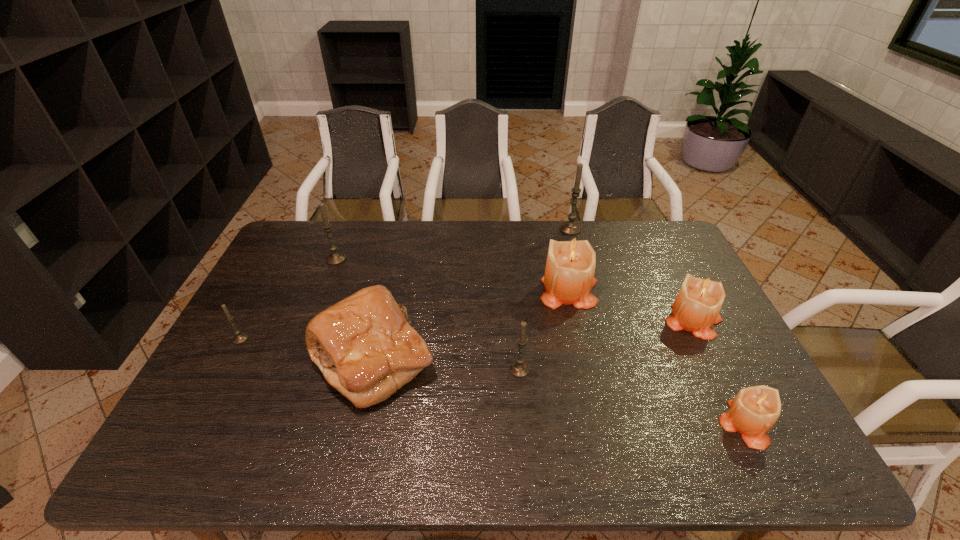
Find the location of a particular element. free space that satisfies the following two spatial constraints: 1. on the filling side of the brownish-beige bread; 2. on the left side of the nearest gray candle is located at coordinates (371, 369).

This screenshot has height=540, width=960. Find the location of `free space that satisfies the following two spatial constraints: 1. on the filling side of the bread; 2. on the back side of the sixth farthest candle`. free space that satisfies the following two spatial constraints: 1. on the filling side of the bread; 2. on the back side of the sixth farthest candle is located at coordinates (371, 369).

The width and height of the screenshot is (960, 540). In order to click on vacant area in the image that satisfies the following two spatial constraints: 1. on the front side of the second biggest beige candle; 2. on the filling side of the third object from left to right in this screenshot , I will do `click(713, 360)`.